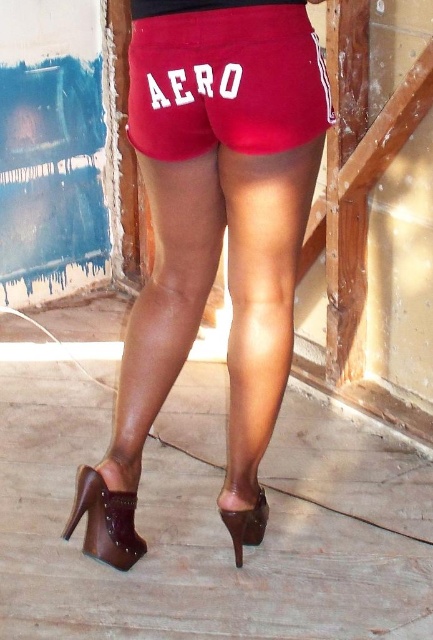
Question: Which object appears closest to the camera in this image?

Choices:
 (A) matte red shorts at center
 (B) brown leather high-heeled shoe at lower left
 (C) brown leather sandal at lower center
 (D) matte leather shorts at center

Answer: (A)

Question: Does matte red shorts at center appear on the right side of brown leather sandal at lower center?

Choices:
 (A) no
 (B) yes

Answer: (A)

Question: Observing the image, what is the correct spatial positioning of matte leather shorts at center in reference to brown leather sandal at lower center?

Choices:
 (A) left
 (B) right

Answer: (A)

Question: Among these objects, which one is nearest to the camera?

Choices:
 (A) brown leather high-heeled shoe at lower left
 (B) matte leather shorts at center

Answer: (B)

Question: Is matte leather shorts at center further to the viewer compared to brown leather high-heeled shoe at lower left?

Choices:
 (A) yes
 (B) no

Answer: (B)

Question: Which point is closer to the camera?

Choices:
 (A) (93, 508)
 (B) (251, 532)
 (C) (217, 104)
 (D) (219, 257)

Answer: (C)